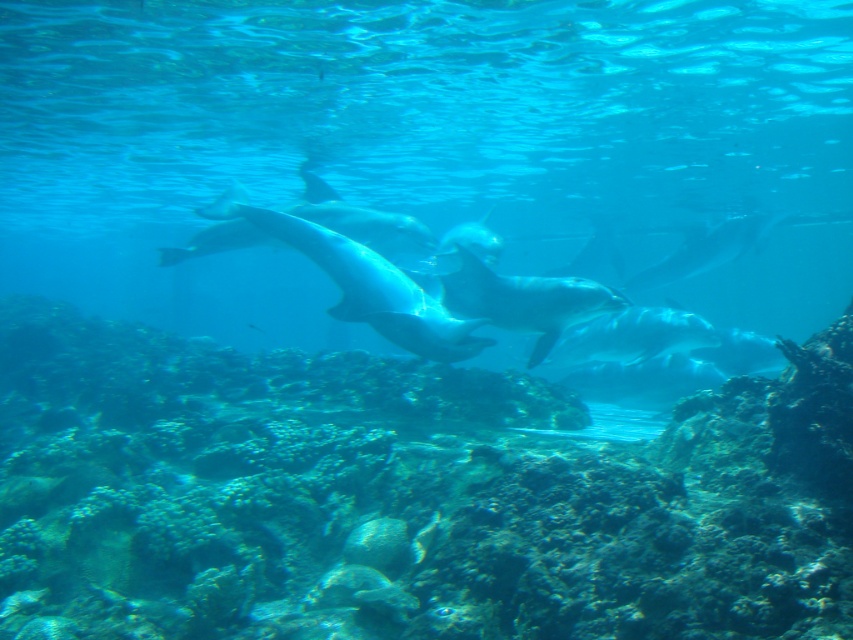
Question: Which object appears closest to the camera in this image?

Choices:
 (A) glossy blue dolphin at center
 (B) green coral reef at center

Answer: (B)

Question: Among these objects, which one is farthest from the camera?

Choices:
 (A) smooth silver dolphin at center
 (B) white smooth dolphin at center
 (C) glossy blue dolphin at center

Answer: (A)

Question: Does green coral reef at center have a smaller size compared to smooth silver dolphin at center?

Choices:
 (A) no
 (B) yes

Answer: (B)

Question: Can you confirm if green coral reef at center is bigger than glossy blue dolphin at center?

Choices:
 (A) yes
 (B) no

Answer: (B)

Question: Which of the following is the closest to the observer?

Choices:
 (A) tap(566, 340)
 (B) tap(692, 243)
 (C) tap(556, 460)
 (D) tap(500, 284)

Answer: (C)

Question: Considering the relative positions of white smooth dolphin at center and glossy white dolphin at center in the image provided, where is white smooth dolphin at center located with respect to glossy white dolphin at center?

Choices:
 (A) below
 (B) above

Answer: (A)